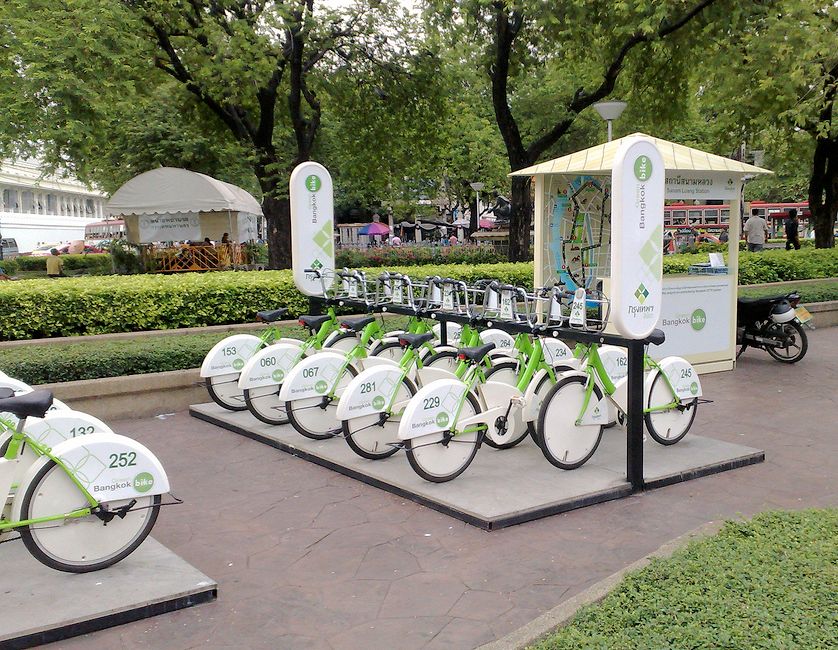
What are the coordinates of `seats` in the screenshot? It's located at (42, 395), (8, 391), (276, 306), (304, 317), (345, 326), (416, 341), (468, 356), (661, 332), (756, 306).